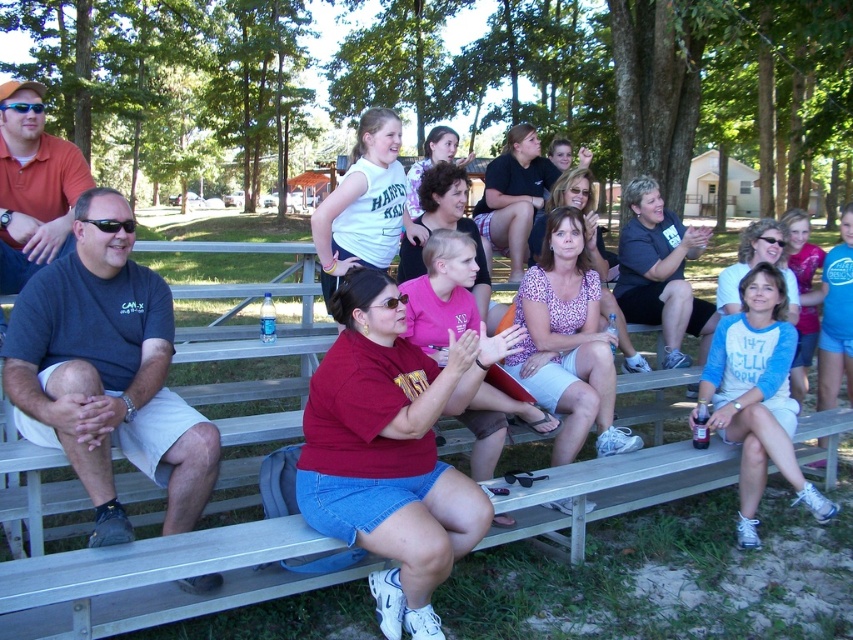
Looking at this image, is dark gray t-shirt at left to the right of white cotton shirt at center from the viewer's perspective?

In fact, dark gray t-shirt at left is to the left of white cotton shirt at center.

Is dark gray t-shirt at left shorter than white cotton shirt at center?

In fact, dark gray t-shirt at left may be taller than white cotton shirt at center.

This screenshot has height=640, width=853. Describe the element at coordinates (107, 372) in the screenshot. I see `dark gray t-shirt at left` at that location.

I want to click on dark gray t-shirt at left, so click(x=107, y=372).